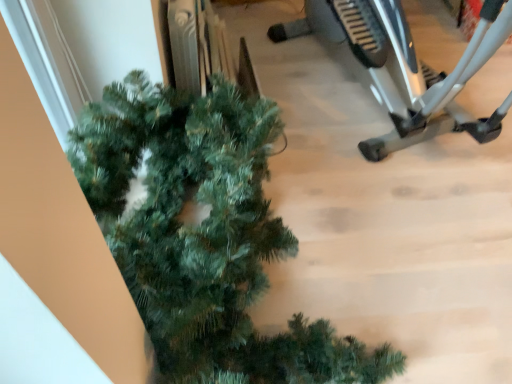
The height and width of the screenshot is (384, 512). I want to click on blank area beneath silver metallic stationary bicycle at right (from a real-world perspective), so click(x=374, y=110).